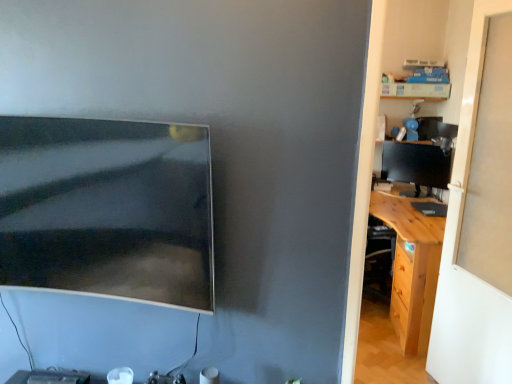
Question: Is wooden desk at right completely or partially outside of light brown wood desk at right?

Choices:
 (A) no
 (B) yes

Answer: (B)

Question: From the image's perspective, is wooden desk at right on light brown wood desk at right?

Choices:
 (A) yes
 (B) no

Answer: (A)

Question: Is wooden desk at right positioned with its back to light brown wood desk at right?

Choices:
 (A) no
 (B) yes

Answer: (B)

Question: Considering the relative sizes of wooden desk at right and light brown wood desk at right in the image provided, is wooden desk at right smaller than light brown wood desk at right?

Choices:
 (A) no
 (B) yes

Answer: (B)

Question: Is wooden desk at right wider than light brown wood desk at right?

Choices:
 (A) no
 (B) yes

Answer: (A)

Question: Is wooden desk at right wider or thinner than matte black monitor at right, placed as the second computer monitor when sorted from left to right?

Choices:
 (A) wide
 (B) thin

Answer: (A)

Question: Considering the positions of wooden desk at right and matte black monitor at right, positioned as the first computer monitor in back-to-front order, in the image, is wooden desk at right taller or shorter than matte black monitor at right, positioned as the first computer monitor in back-to-front order,?

Choices:
 (A) short
 (B) tall

Answer: (B)

Question: From the image's perspective, is wooden desk at right above or below matte black monitor at right, placed as the second computer monitor when sorted from left to right?

Choices:
 (A) below
 (B) above

Answer: (A)

Question: In the image, is wooden desk at right on the left side or the right side of matte black monitor at right, placed as the second computer monitor when sorted from left to right?

Choices:
 (A) right
 (B) left

Answer: (B)

Question: In the image, is matte black monitor at right, marked as the 2th computer monitor in a front-to-back arrangement, on the left side or the right side of wooden desk at right?

Choices:
 (A) left
 (B) right

Answer: (B)

Question: Looking at their shapes, would you say matte black monitor at right, placed as the second computer monitor when sorted from left to right, is wider or thinner than wooden desk at right?

Choices:
 (A) thin
 (B) wide

Answer: (A)

Question: Considering their positions, is matte black monitor at right, the 1th computer monitor positioned from the right, located in front of or behind wooden desk at right?

Choices:
 (A) behind
 (B) front

Answer: (A)

Question: Is point (396, 147) positioned closer to the camera than point (449, 114)?

Choices:
 (A) closer
 (B) farther

Answer: (B)

Question: Is wooden desk at right in front of or behind matte black monitor at upper left, the 2th computer monitor positioned from the back, in the image?

Choices:
 (A) front
 (B) behind

Answer: (A)

Question: Considering the positions of wooden desk at right and matte black monitor at upper left, the 2th computer monitor positioned from the back, in the image, is wooden desk at right wider or thinner than matte black monitor at upper left, the 2th computer monitor positioned from the back,?

Choices:
 (A) thin
 (B) wide

Answer: (A)